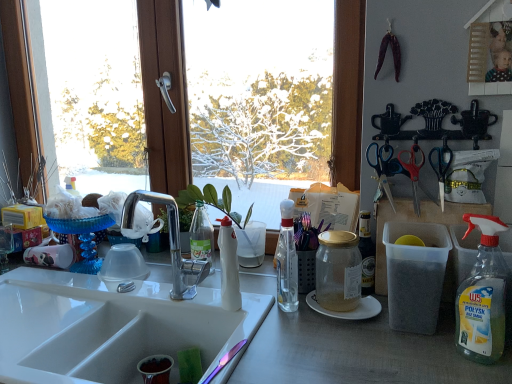
Where is `vacant position to the left of clear plastic bottle at right, the fourth bottle when ordered from left to right`? Image resolution: width=512 pixels, height=384 pixels. vacant position to the left of clear plastic bottle at right, the fourth bottle when ordered from left to right is located at coordinates click(x=404, y=355).